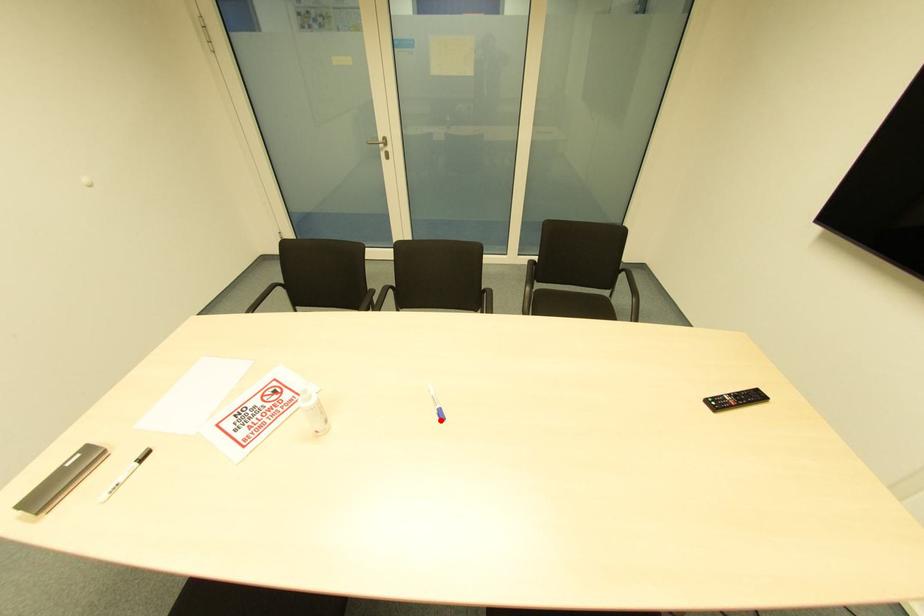
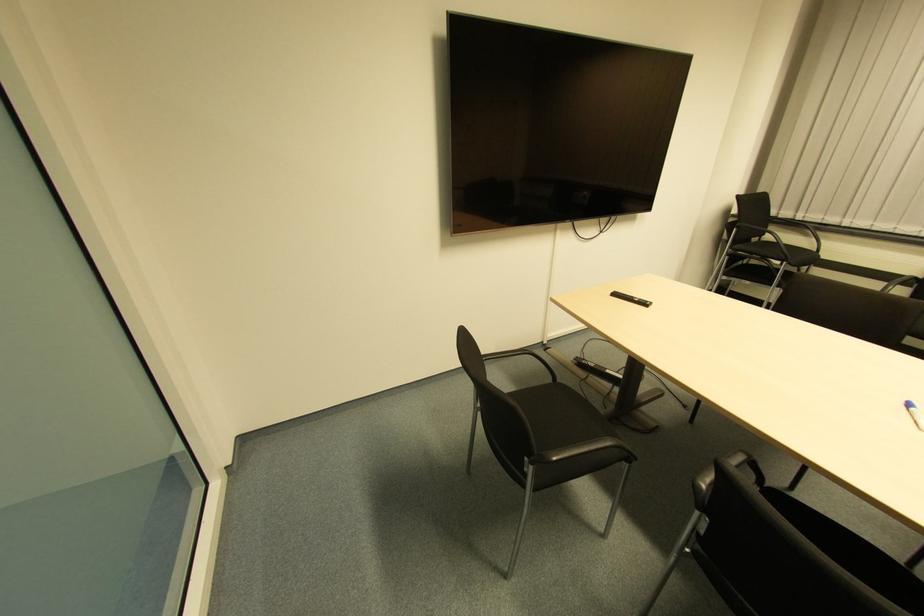
Question: A red point is marked in image1. In image2, is the corresponding 3D point closer to the camera or farther? Reply with the corresponding letter.

Choices:
 (A) The corresponding 3D point is closer.
 (B) The corresponding 3D point is farther.

Answer: (B)